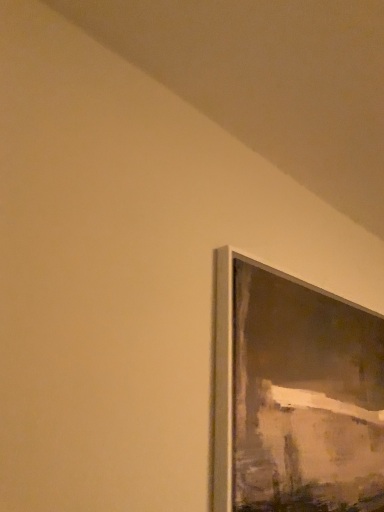
Question: Should I look upward or downward to see metallic silver picture frame at upper right?

Choices:
 (A) down
 (B) up

Answer: (A)